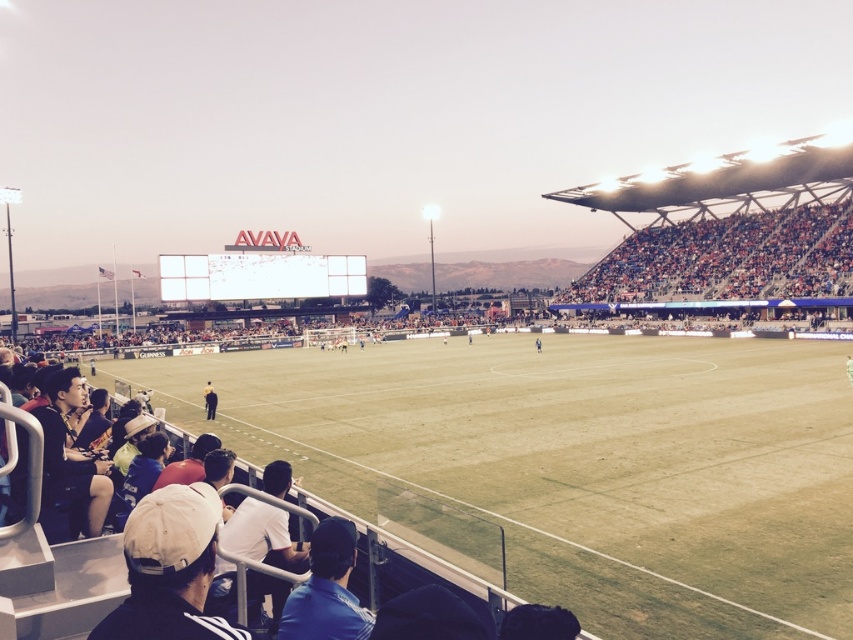
Does multicolored fabric seats at right lie behind blue jersey at center?

Yes, it is.

Does multicolored fabric seats at right appear on the left side of blue jersey at center?

No, multicolored fabric seats at right is not to the left of blue jersey at center.

Between point (730, 232) and point (537, 352), which one is positioned in front?

Point (537, 352) is more forward.

Where is `multicolored fabric seats at right`? The height and width of the screenshot is (640, 853). multicolored fabric seats at right is located at coordinates (728, 259).

Who is positioned more to the right, dark blue shirt at lower left or blue jersey at center?

Positioned to the right is blue jersey at center.

Between dark blue shirt at lower left and blue jersey at center, which one is positioned lower?

dark blue shirt at lower left

At what (x,y) coordinates should I click in order to perform the action: click on dark blue shirt at lower left. Please return your answer as a coordinate pair (x, y). This screenshot has width=853, height=640. Looking at the image, I should click on (209, 401).

Measure the distance between multicolored fabric seats at right and camera.

multicolored fabric seats at right and camera are 68.45 meters apart from each other.

Can you confirm if multicolored fabric seats at right is bigger than blue fabric jacket at lower center?

Yes, multicolored fabric seats at right is bigger than blue fabric jacket at lower center.

Where is `multicolored fabric seats at right`? The height and width of the screenshot is (640, 853). multicolored fabric seats at right is located at coordinates (728, 259).